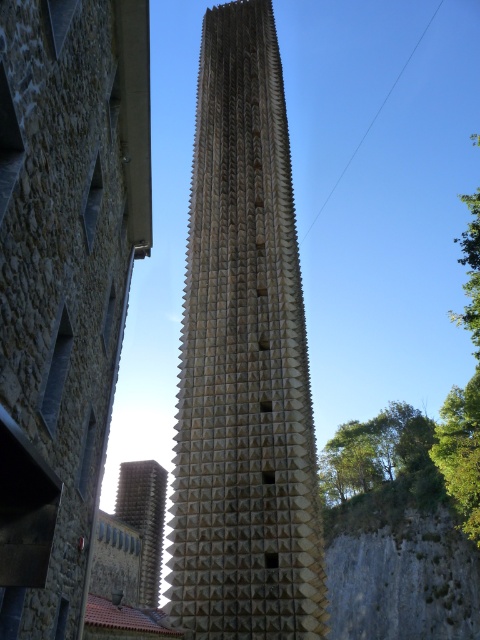
You are an architect analyzing the central features of the scene. Which of the two central structures, the sandy beige textured tower at center or the golden textured spire at center, has a greater width?

The sandy beige textured tower at center has a greater width than the golden textured spire at center according to the description.

Looking at this image, you are an architect reviewing a design blueprint. The blueprint shows the sandy beige textured tower at center and the golden textured spire at center. Which of the two structures is bigger in size?

The sandy beige textured tower at center is larger in size compared to the golden textured spire at center according to the description.

You are an architect analyzing the layout of the structures in the image. Based on the scene, which object is located to the left of the other between the sandy beige textured tower at center and the golden textured spire at center?

The sandy beige textured tower at center is positioned on the right side of golden textured spire at center, so the golden textured spire at center is to the left of the sandy beige textured tower at center.